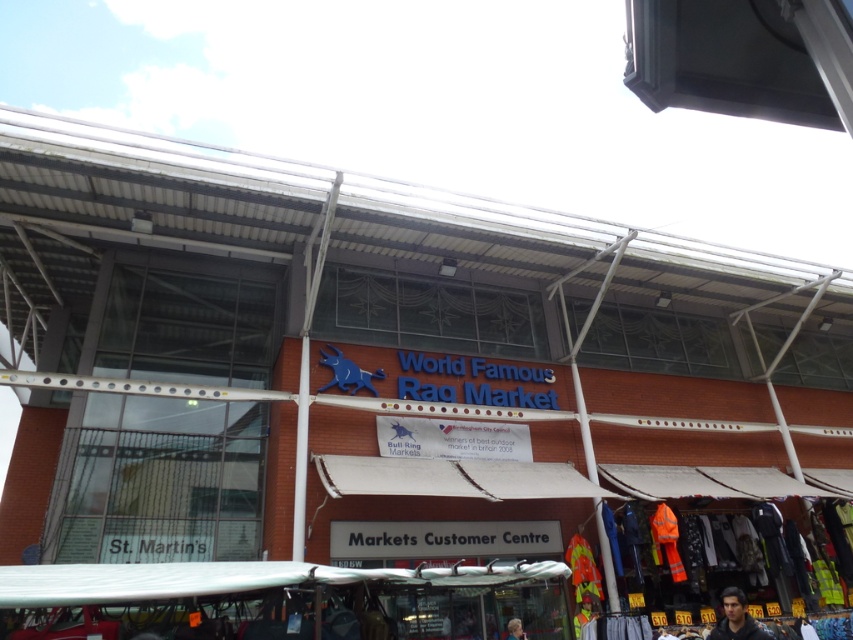
Question: Which point is closer to the camera taking this photo?

Choices:
 (A) (521, 632)
 (B) (733, 618)

Answer: (B)

Question: Where is dark blue jacket at lower right located in relation to smooth skin face at lower center in the image?

Choices:
 (A) right
 (B) left

Answer: (A)

Question: Does dark blue jacket at lower right have a smaller size compared to smooth skin face at lower center?

Choices:
 (A) yes
 (B) no

Answer: (B)

Question: Which point is farther to the camera?

Choices:
 (A) dark blue jacket at lower right
 (B) smooth skin face at lower center

Answer: (B)

Question: Does dark blue jacket at lower right have a greater width compared to smooth skin face at lower center?

Choices:
 (A) no
 (B) yes

Answer: (B)

Question: Which point is closer to the camera?

Choices:
 (A) dark blue jacket at lower right
 (B) smooth skin face at lower center

Answer: (A)